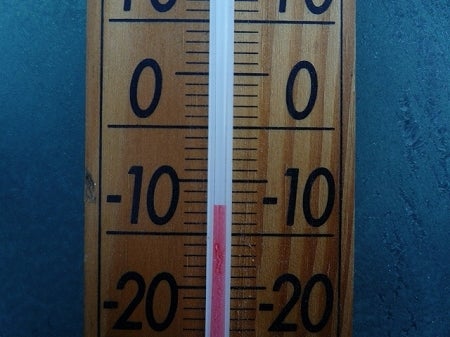
At what (x,y) coordinates should I click in order to perform the action: click on thermometer. Please return your answer as a coordinate pair (x, y). The height and width of the screenshot is (337, 450). Looking at the image, I should click on (182, 108).